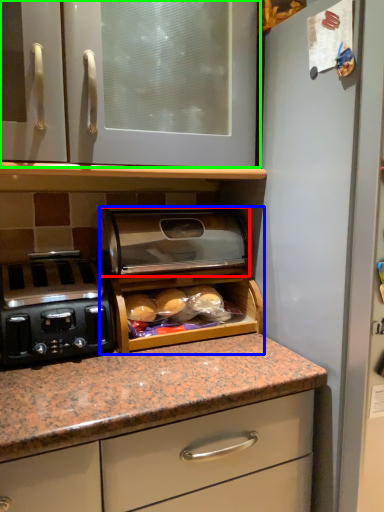
Question: Which is nearer to the appliance (highlighted by a red box)? appliance (highlighted by a blue box) or cabinetry (highlighted by a green box).

Choices:
 (A) appliance
 (B) cabinetry

Answer: (A)